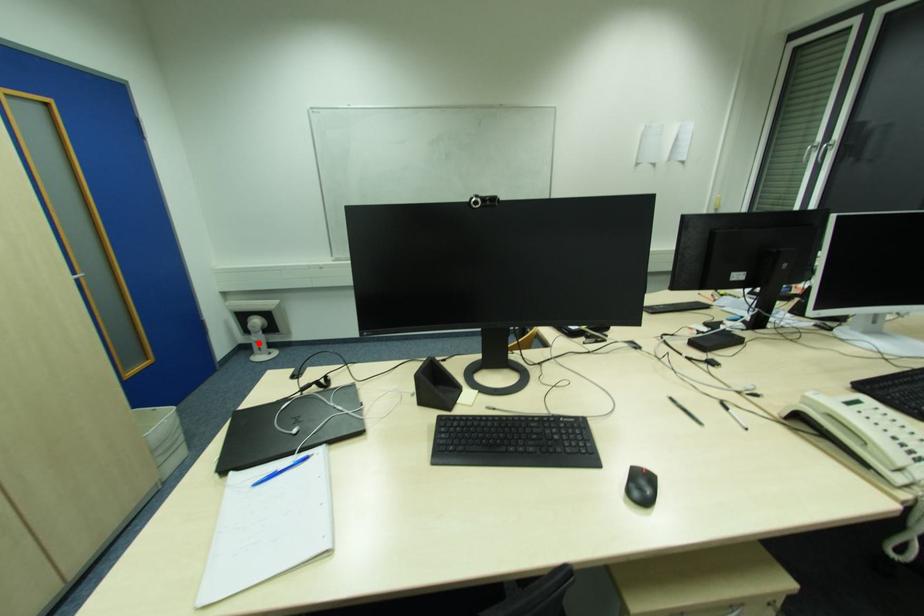
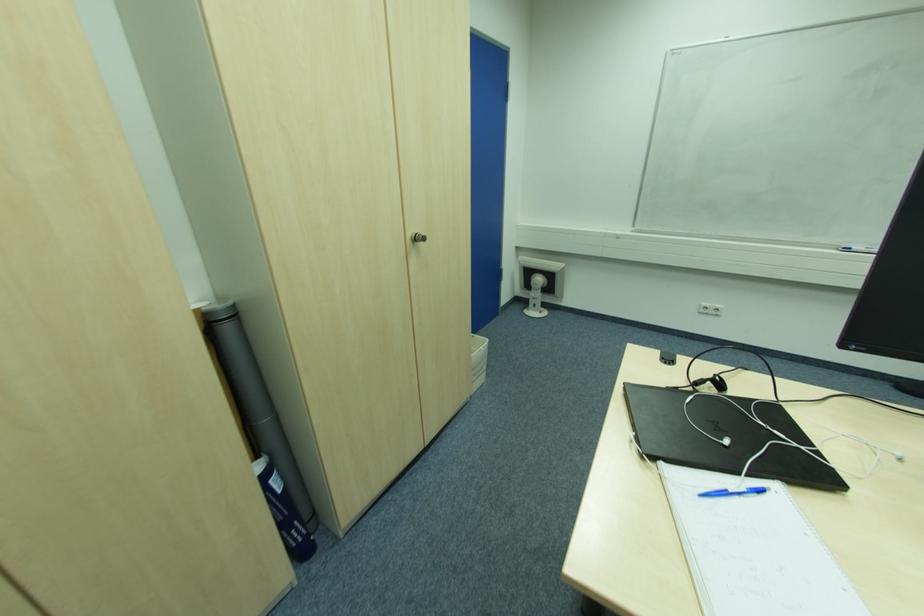
Question: I am providing you with two images of the same scene from different viewpoints. Image1 has a red point marked. In image2, the corresponding 3D location appears at what relative position? Reply with the corresponding letter.

Choices:
 (A) Closer
 (B) Farther

Answer: (A)